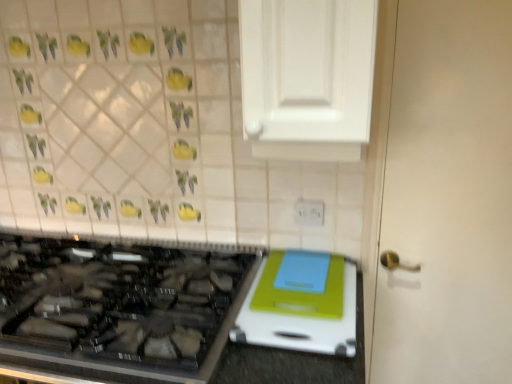
Question: Is white plastic electric outlet at upper center in contact with white matte door at right?

Choices:
 (A) no
 (B) yes

Answer: (A)

Question: Considering the relative sizes of white plastic electric outlet at upper center and white matte door at right in the image provided, is white plastic electric outlet at upper center thinner than white matte door at right?

Choices:
 (A) yes
 (B) no

Answer: (A)

Question: Considering the relative positions of white plastic electric outlet at upper center and white matte door at right in the image provided, is white plastic electric outlet at upper center to the right of white matte door at right from the viewer's perspective?

Choices:
 (A) yes
 (B) no

Answer: (B)

Question: Is white plastic electric outlet at upper center positioned far away from white matte door at right?

Choices:
 (A) yes
 (B) no

Answer: (B)

Question: Is white plastic electric outlet at upper center positioned with its back to white matte door at right?

Choices:
 (A) yes
 (B) no

Answer: (B)

Question: Is white glossy cabinet at upper center taller or shorter than white matte door at right?

Choices:
 (A) tall
 (B) short

Answer: (B)

Question: From the image's perspective, is white glossy cabinet at upper center above or below white matte door at right?

Choices:
 (A) above
 (B) below

Answer: (A)

Question: Is point (308, 14) closer or farther from the camera than point (374, 377)?

Choices:
 (A) farther
 (B) closer

Answer: (B)

Question: Is white glossy cabinet at upper center bigger or smaller than white matte door at right?

Choices:
 (A) small
 (B) big

Answer: (B)

Question: In terms of width, does white plastic cutting board at lower right look wider or thinner when compared to white matte door at right?

Choices:
 (A) wide
 (B) thin

Answer: (A)

Question: Considering the positions of white plastic cutting board at lower right and white matte door at right in the image, is white plastic cutting board at lower right bigger or smaller than white matte door at right?

Choices:
 (A) big
 (B) small

Answer: (B)

Question: From the image's perspective, is white plastic cutting board at lower right positioned above or below white matte door at right?

Choices:
 (A) below
 (B) above

Answer: (A)

Question: From their relative heights in the image, would you say white plastic cutting board at lower right is taller or shorter than white matte door at right?

Choices:
 (A) tall
 (B) short

Answer: (B)

Question: From the image's perspective, is white plastic electric outlet at upper center located above or below black glass gas stove at lower left?

Choices:
 (A) above
 (B) below

Answer: (A)

Question: Is white plastic electric outlet at upper center inside or outside of black glass gas stove at lower left?

Choices:
 (A) outside
 (B) inside

Answer: (A)